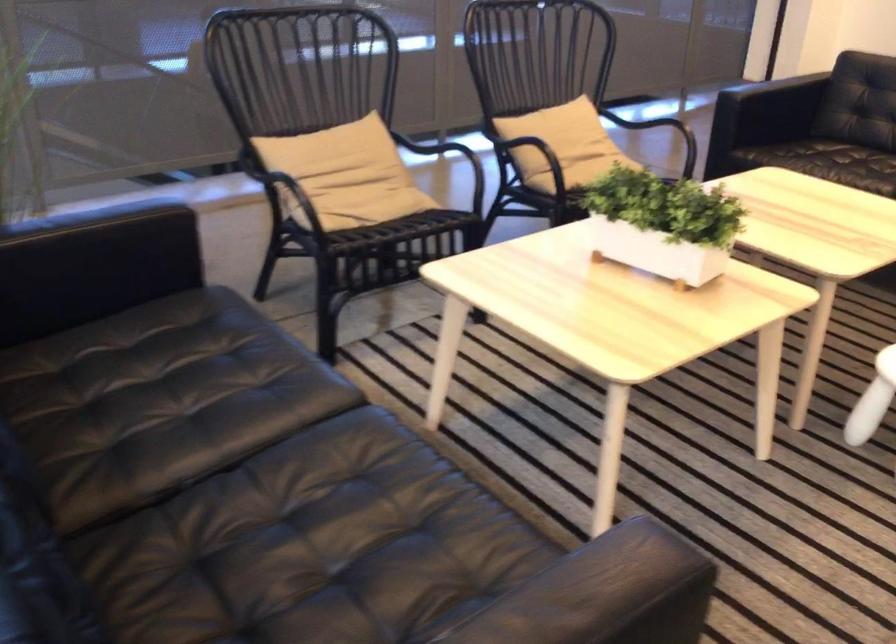
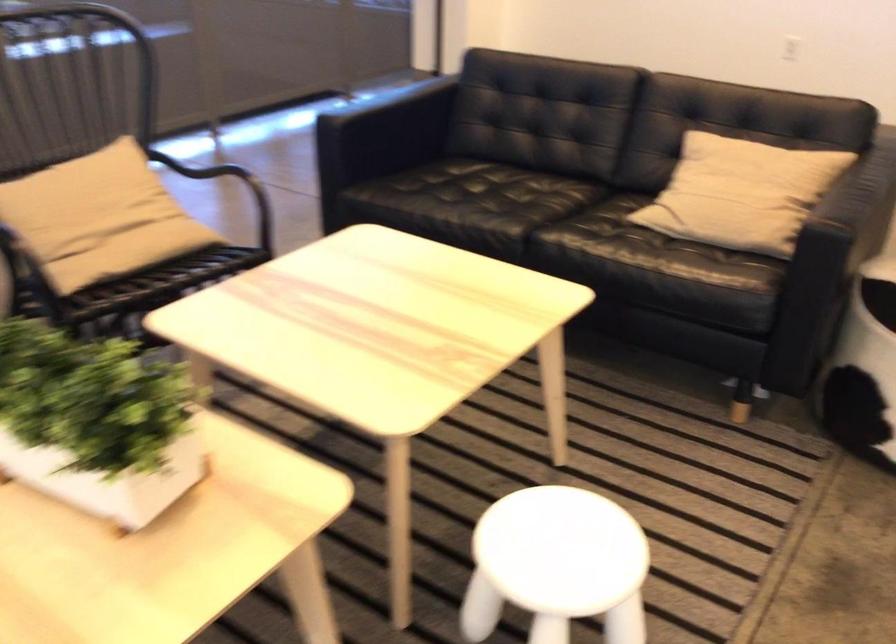
In a continuous first-person perspective shot, in which direction is the camera moving?

The cameraman moved toward right, forward.